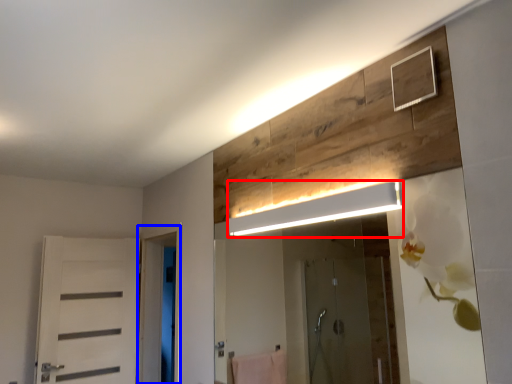
Question: Among these objects, which one is nearest to the camera, light fixture (highlighted by a red box) or screen door (highlighted by a blue box)?

Choices:
 (A) light fixture
 (B) screen door

Answer: (A)